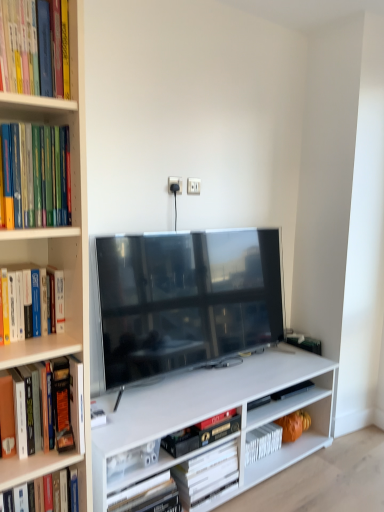
In order to face hardcover book at center, which is counted as the second book, starting from the bottom, should I rotate leftwards or rightwards?

A 0.767 degree turn to the right will do.

Describe the element at coordinates (38, 174) in the screenshot. I see `hardcover books at left, which ranks as the 3th book in bottom-to-top order` at that location.

Identify the location of hardcover book at lower center, the 4th book viewed from the top. (206, 473).

Identify the location of hardcover book at center, which is counted as the second book, starting from the bottom. (202, 433).

Are hardcover books at left, positioned as the 2th book in top-to-bottom order, and matte black tv at center making contact?

hardcover books at left, positioned as the 2th book in top-to-bottom order, and matte black tv at center are clearly separated.

Image resolution: width=384 pixels, height=512 pixels. Find the location of `the 2nd book in front of the matte black tv at center`. the 2nd book in front of the matte black tv at center is located at coordinates (38, 174).

In the scene shown: Is hardcover books at left, the second book from the front, oriented away from matte black tv at center?

No, hardcover books at left, the second book from the front, is not facing away from matte black tv at center.

Looking at the image, does hardcover books at left, the second book from the front, seem bigger or smaller compared to matte black tv at center?

Considering their sizes, hardcover books at left, the second book from the front, takes up less space than matte black tv at center.

From a real-world perspective, who is located lower, hardcover books at left, marked as the 3th book in a back-to-front arrangement, or hardcover book at lower center, the 4th book viewed from the front?

hardcover book at lower center, the 4th book viewed from the front, from a real-world perspective.

From the image's perspective, between hardcover books at left, which ranks as the 3th book in bottom-to-top order, and hardcover book at lower center, the 4th book viewed from the top, which one is located above?

From the image's view, hardcover books at left, which ranks as the 3th book in bottom-to-top order, is above.

Looking at the image, does hardcover books at left, the second book from the front, seem bigger or smaller compared to hardcover book at lower center, the 4th book viewed from the top?

Considering their sizes, hardcover books at left, the second book from the front, takes up less space than hardcover book at lower center, the 4th book viewed from the top.

From the image's perspective, does hardcover book at upper left, which ranks as the 1th book in top-to-bottom order, appear lower than hardcover book at lower center, the 1th book from the bottom?

Incorrect, from the image's perspective, hardcover book at upper left, which ranks as the 1th book in top-to-bottom order, is higher than hardcover book at lower center, the 1th book from the bottom.

Based on the photo, is hardcover book at upper left, the fourth book in the back-to-front sequence, further to camera compared to hardcover book at lower center, the 4th book viewed from the top?

No.

From a real-world perspective, is hardcover book at upper left, the first book positioned from the front, beneath hardcover book at lower center, the 4th book viewed from the front?

No, from a real-world perspective, hardcover book at upper left, the first book positioned from the front, is not beneath hardcover book at lower center, the 4th book viewed from the front.

Which object is positioned more to the left, matte black tv at center or hardcover books at left, the second book from the front?

hardcover books at left, the second book from the front.

Between point (125, 343) and point (68, 202), which one is positioned in front?

Positioned in front is point (68, 202).

In the image, is matte black tv at center positioned in front of or behind hardcover books at left, which ranks as the 3th book in bottom-to-top order?

In the image, matte black tv at center appears behind hardcover books at left, which ranks as the 3th book in bottom-to-top order.

From their relative heights in the image, would you say matte black tv at center is taller or shorter than hardcover book at upper left, which ranks as the 1th book in top-to-bottom order?

matte black tv at center is taller than hardcover book at upper left, which ranks as the 1th book in top-to-bottom order.

Are matte black tv at center and hardcover book at upper left, which ranks as the 1th book in top-to-bottom order, far apart?

Absolutely, matte black tv at center is distant from hardcover book at upper left, which ranks as the 1th book in top-to-bottom order.

Is matte black tv at center aimed at hardcover book at upper left, the fourth book in the back-to-front sequence?

No, matte black tv at center does not turn towards hardcover book at upper left, the fourth book in the back-to-front sequence.

Is matte black tv at center not within hardcover book at upper left, which ranks as the fourth book in bottom-to-top order?

Absolutely, matte black tv at center is external to hardcover book at upper left, which ranks as the fourth book in bottom-to-top order.

Is hardcover book at upper left, which ranks as the fourth book in bottom-to-top order, directly adjacent to matte black tv at center?

hardcover book at upper left, which ranks as the fourth book in bottom-to-top order, is not next to matte black tv at center, and they're not touching.

At what (x,y) coordinates should I click in order to perform the action: click on the 2nd book above the matte black tv at center (from a real-world perspective). Please return your answer as a coordinate pair (x, y). Looking at the image, I should click on (19, 47).

From the image's perspective, is hardcover book at upper left, the fourth book in the back-to-front sequence, over matte black tv at center?

Yes, from the image's perspective, hardcover book at upper left, the fourth book in the back-to-front sequence, is over matte black tv at center.

Considering the relative positions of hardcover book at upper left, the fourth book in the back-to-front sequence, and matte black tv at center in the image provided, is hardcover book at upper left, the fourth book in the back-to-front sequence, in front of matte black tv at center?

Yes, hardcover book at upper left, the fourth book in the back-to-front sequence, is closer to the camera.

Which is less distant, [191,432] or [198,483]?

The point [191,432] is more forward.

Does hardcover book at center, which is counted as the second book, starting from the bottom, have a greater height compared to hardcover book at lower center, the first book from the back?

Incorrect, the height of hardcover book at center, which is counted as the second book, starting from the bottom, is not larger of that of hardcover book at lower center, the first book from the back.

Is hardcover book at center, which is the 2th book in back-to-front order, turned away from hardcover book at lower center, the first book from the back?

No.

You are a GUI agent. You are given a task and a screenshot of the screen. Output one action in this format:
    pyautogui.click(x=<x>, y=<y>)
    Task: Click on the book on the right of hardcover book at center, which is the 2th book in back-to-front order
    The height and width of the screenshot is (512, 384).
    Given the screenshot: What is the action you would take?
    pyautogui.click(x=206, y=473)

Identify the location of the 3rd book to the left when counting from the matte black tv at center. The image size is (384, 512). (38, 174).

You are a GUI agent. You are given a task and a screenshot of the screen. Output one action in this format:
    pyautogui.click(x=<x>, y=<y>)
    Task: Click on the 2nd book above when counting from the hardcover book at lower center, the first book from the back (from the image's perspective)
    The height and width of the screenshot is (512, 384).
    Given the screenshot: What is the action you would take?
    pyautogui.click(x=38, y=174)

From the image, which object appears to be farther from hardcover book at center, which is counted as the second book, starting from the bottom, hardcover book at lower center, the first book from the back, or hardcover book at upper left, which ranks as the 1th book in top-to-bottom order?

hardcover book at upper left, which ranks as the 1th book in top-to-bottom order, is further to hardcover book at center, which is counted as the second book, starting from the bottom.

From the image, which object appears to be nearer to hardcover books at left, marked as the 3th book in a back-to-front arrangement, hardcover book at upper left, the fourth book in the back-to-front sequence, or hardcover book at lower center, the first book from the back?

hardcover book at upper left, the fourth book in the back-to-front sequence.

Which object lies nearer to the anchor point hardcover book at upper left, which ranks as the 1th book in top-to-bottom order, hardcover book at center, which is counted as the second book, starting from the bottom, or hardcover book at lower center, the 4th book viewed from the front?

The object closer to hardcover book at upper left, which ranks as the 1th book in top-to-bottom order, is hardcover book at center, which is counted as the second book, starting from the bottom.

When comparing their distances from hardcover book at lower center, the 1th book from the bottom, does hardcover book at center, which is the 3th book in top-to-bottom order, or hardcover books at left, the second book from the front, seem further?

hardcover books at left, the second book from the front, is positioned further to the anchor hardcover book at lower center, the 1th book from the bottom.

From the image, which object appears to be farther from hardcover book at lower center, the 4th book viewed from the front, hardcover book at center, which is the 3th book in top-to-bottom order, or matte black tv at center?

matte black tv at center is further to hardcover book at lower center, the 4th book viewed from the front.

In the scene shown: Considering their positions, is hardcover book at center, which is the 2th book in back-to-front order, positioned closer to hardcover books at left, positioned as the 2th book in top-to-bottom order, than hardcover book at upper left, which ranks as the fourth book in bottom-to-top order?

Based on the image, hardcover book at upper left, which ranks as the fourth book in bottom-to-top order, appears to be nearer to hardcover books at left, positioned as the 2th book in top-to-bottom order.

Looking at the image, which one is located further to hardcover book at upper left, which ranks as the 1th book in top-to-bottom order, hardcover books at left, which ranks as the 3th book in bottom-to-top order, or hardcover book at center, which is counted as the second book, starting from the bottom?

Based on the image, hardcover book at center, which is counted as the second book, starting from the bottom, appears to be further to hardcover book at upper left, which ranks as the 1th book in top-to-bottom order.

Which object lies nearer to the anchor point hardcover book at lower center, the first book from the back, hardcover books at left, which ranks as the 3th book in bottom-to-top order, or matte black tv at center?

The object closer to hardcover book at lower center, the first book from the back, is matte black tv at center.

What are the coordinates of `television between hardcover books at left, which ranks as the 3th book in bottom-to-top order, and hardcover book at center, which is the 2th book in back-to-front order, from top to bottom` in the screenshot? It's located at (185, 300).

I want to click on book between matte black tv at center and hardcover book at lower center, the 1th book from the bottom, vertically, so click(202, 433).

The width and height of the screenshot is (384, 512). What are the coordinates of `book that lies between hardcover books at left, which ranks as the 3th book in bottom-to-top order, and hardcover book at lower center, the first book from the back, from top to bottom` in the screenshot? It's located at (202, 433).

This screenshot has width=384, height=512. What are the coordinates of `television between hardcover books at left, the second book from the front, and hardcover book at lower center, the 4th book viewed from the front, in the vertical direction` in the screenshot? It's located at (185, 300).